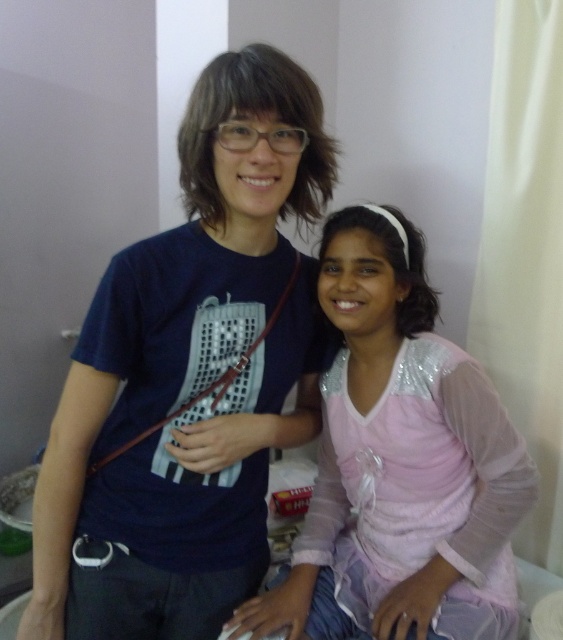
Does blue matte t-shirt at center come in front of pink satin dress at center?

Yes.

Which is in front, point (325, 332) or point (399, 467)?

Point (399, 467) is in front.

Describe the element at coordinates (189, 376) in the screenshot. The width and height of the screenshot is (563, 640). I see `blue matte t-shirt at center` at that location.

This screenshot has height=640, width=563. What are the coordinates of `blue matte t-shirt at center` in the screenshot? It's located at (189, 376).